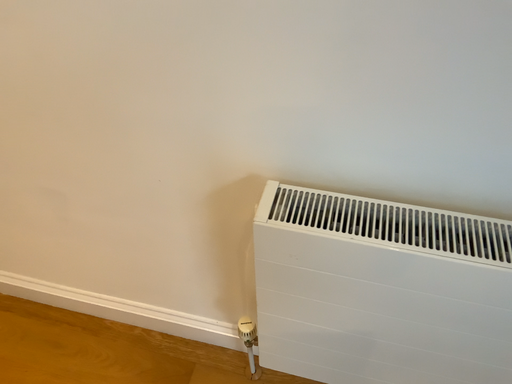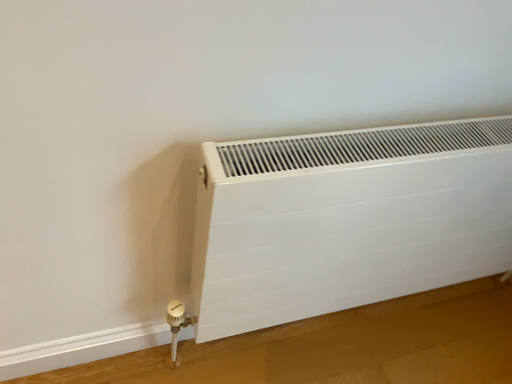
Question: Which way did the camera rotate in the video?

Choices:
 (A) rotated right
 (B) rotated left

Answer: (A)